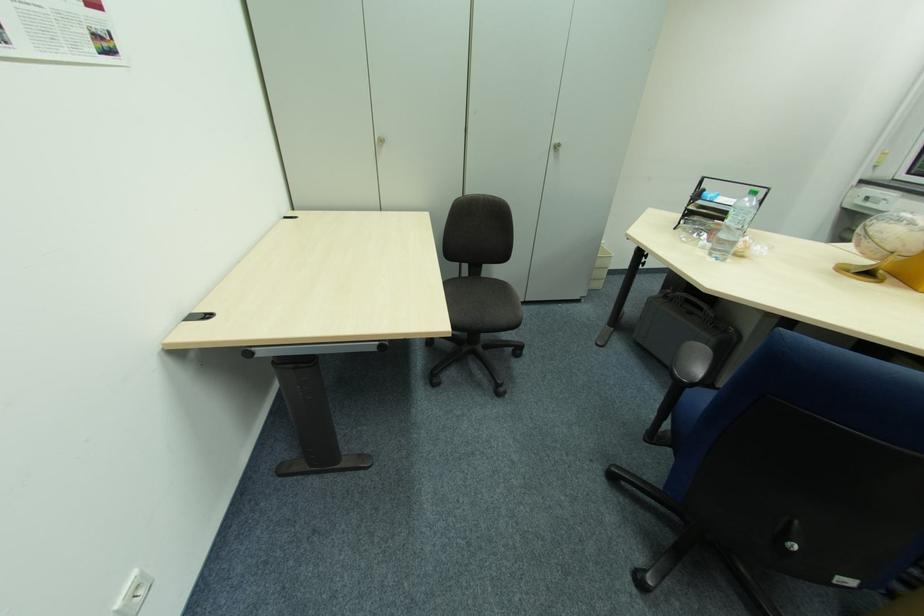
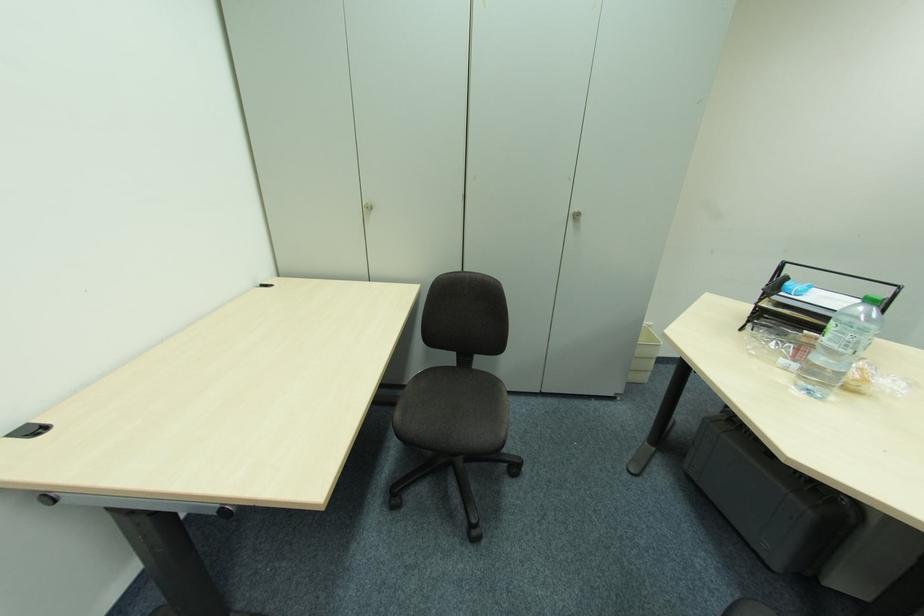
Find the pixel in the second image that matches the point at 554,150 in the first image.

(574, 219)